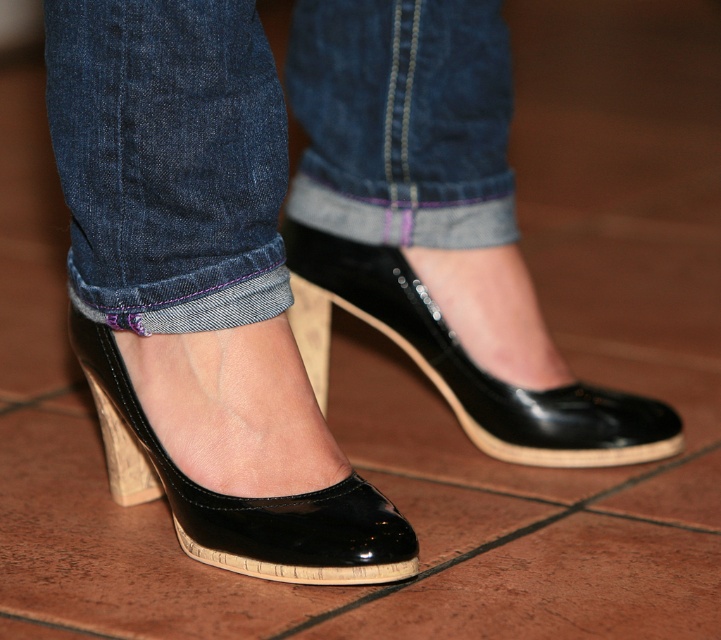
Question: Does denim at lower center come in front of glossy patent leather shoe at center?

Choices:
 (A) no
 (B) yes

Answer: (B)

Question: Which object is farther from the camera taking this photo?

Choices:
 (A) glossy patent leather shoe at lower center
 (B) denim at lower center

Answer: (B)

Question: Considering the relative positions of glossy patent leather shoe at center and glossy patent leather shoe at lower center in the image provided, where is glossy patent leather shoe at center located with respect to glossy patent leather shoe at lower center?

Choices:
 (A) below
 (B) above

Answer: (B)

Question: Which of the following is the closest to the observer?

Choices:
 (A) glossy patent leather shoe at lower center
 (B) glossy patent leather shoe at center

Answer: (A)

Question: Which of the following is the closest to the observer?

Choices:
 (A) denim at lower center
 (B) glossy patent leather shoe at center

Answer: (A)

Question: Where is glossy patent leather shoe at center located in relation to glossy patent leather shoe at lower center in the image?

Choices:
 (A) left
 (B) right

Answer: (B)